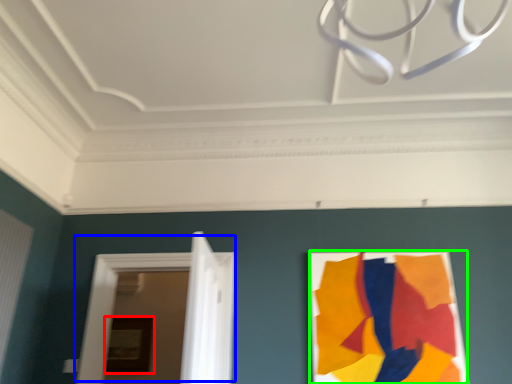
Question: Which is farther away from picture frame (highlighted by a red box)? door (highlighted by a blue box) or poster (highlighted by a green box)?

Choices:
 (A) door
 (B) poster

Answer: (B)